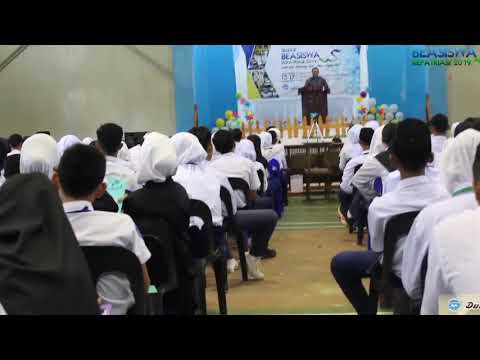
In order to click on speaker in this screenshot , I will do `click(314, 78)`.